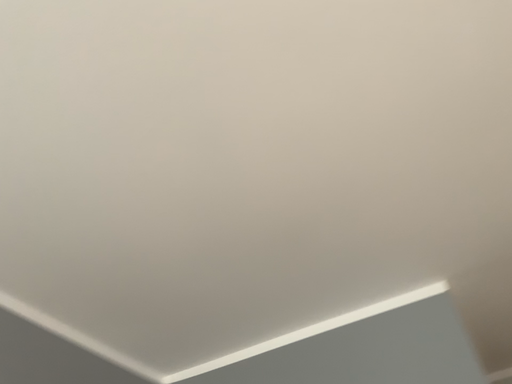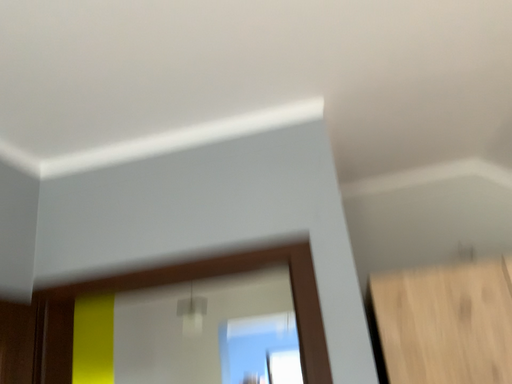
Question: How did the camera likely rotate when shooting the video?

Choices:
 (A) rotated left
 (B) rotated right

Answer: (B)